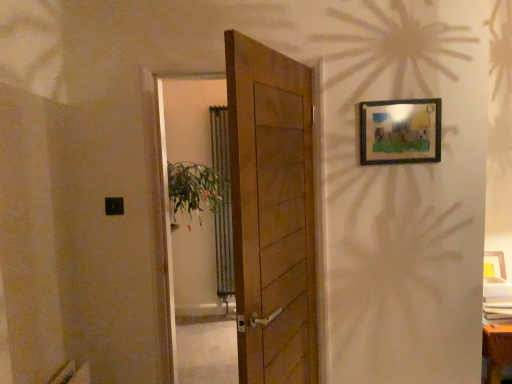
Question: Is wooden picture frame at upper right thinner than wooden door at center?

Choices:
 (A) no
 (B) yes

Answer: (B)

Question: From the image's perspective, does wooden picture frame at upper right appear lower than wooden door at center?

Choices:
 (A) yes
 (B) no

Answer: (B)

Question: From a real-world perspective, is wooden picture frame at upper right located higher than wooden door at center?

Choices:
 (A) no
 (B) yes

Answer: (B)

Question: Is wooden picture frame at upper right smaller than wooden door at center?

Choices:
 (A) no
 (B) yes

Answer: (B)

Question: Is wooden picture frame at upper right oriented away from wooden door at center?

Choices:
 (A) no
 (B) yes

Answer: (A)

Question: Does wooden picture frame at upper right turn towards wooden door at center?

Choices:
 (A) no
 (B) yes

Answer: (A)

Question: Is wooden door at center inside wooden door at center?

Choices:
 (A) no
 (B) yes

Answer: (A)

Question: Does wooden door at center lie behind wooden door at center?

Choices:
 (A) no
 (B) yes

Answer: (A)

Question: Is wooden door at center at the right side of wooden door at center?

Choices:
 (A) yes
 (B) no

Answer: (A)

Question: Are wooden door at center and wooden door at center making contact?

Choices:
 (A) yes
 (B) no

Answer: (B)

Question: Considering the relative positions of wooden door at center and wooden door at center in the image provided, is wooden door at center in front of wooden door at center?

Choices:
 (A) no
 (B) yes

Answer: (B)

Question: From a real-world perspective, is wooden door at center beneath wooden door at center?

Choices:
 (A) no
 (B) yes

Answer: (B)

Question: Can wooden picture frame at upper right be found inside wooden door at center?

Choices:
 (A) yes
 (B) no

Answer: (B)